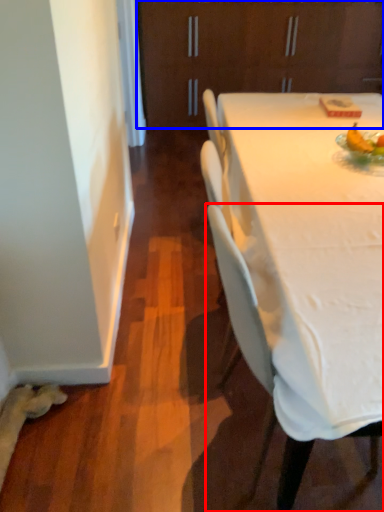
Question: Which of the following is the farthest to the observer, chair (highlighted by a red box) or cabinetry (highlighted by a blue box)?

Choices:
 (A) chair
 (B) cabinetry

Answer: (B)